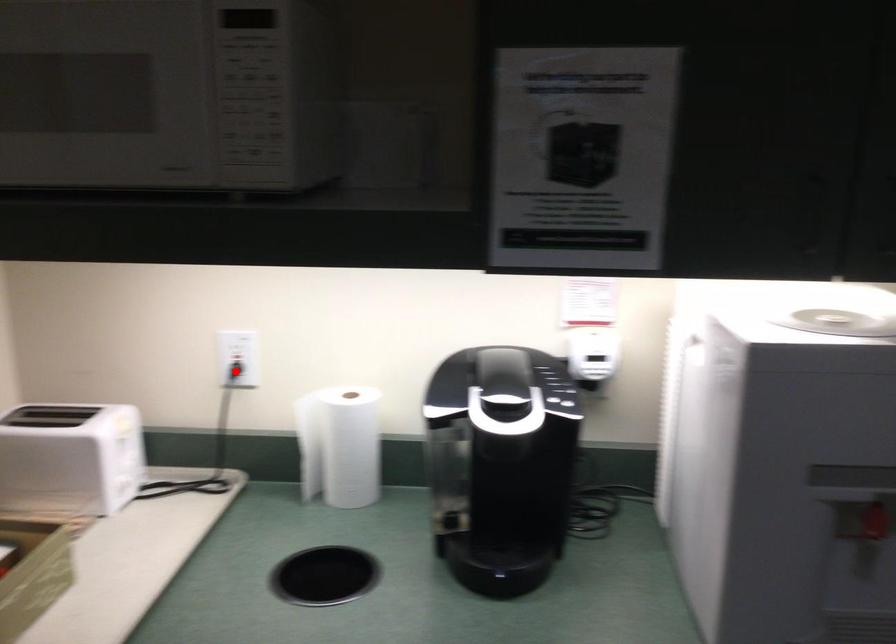
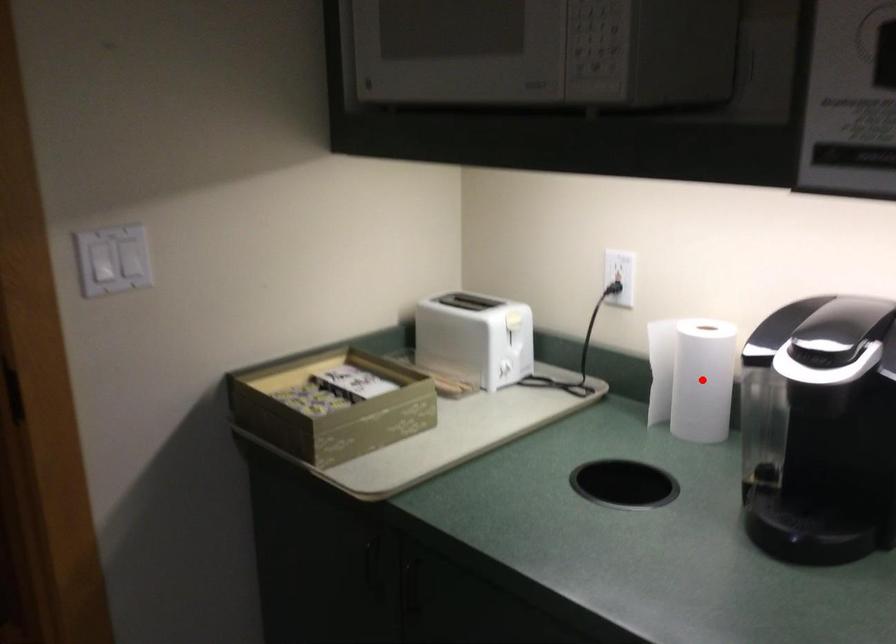
I am providing you with two images of the same scene from different viewpoints. A red point is marked on the first image and another point is marked on the second image. Is the red point in image1 aligned with the point shown in image2?

No